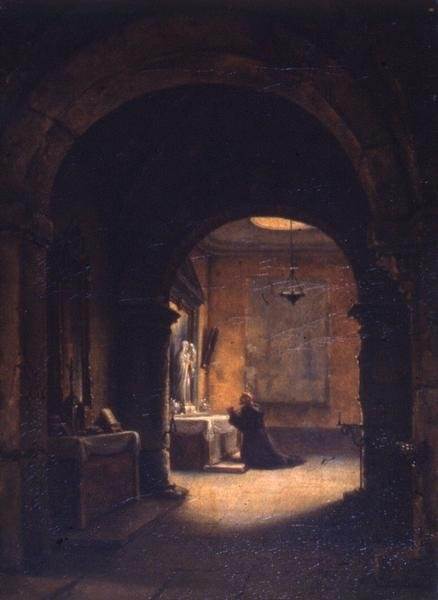
Where is `archway`? The height and width of the screenshot is (600, 438). archway is located at coordinates (359, 368), (357, 296), (168, 315).